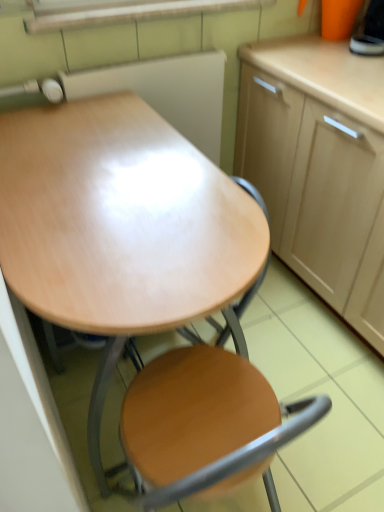
What do you see at coordinates (320, 167) in the screenshot? The image size is (384, 512). I see `light wood cabinet at upper right` at bounding box center [320, 167].

The width and height of the screenshot is (384, 512). I want to click on wooden at center, so click(x=205, y=424).

This screenshot has width=384, height=512. What do you see at coordinates (205, 424) in the screenshot?
I see `wooden at center` at bounding box center [205, 424].

The image size is (384, 512). Identify the location of light wood cabinet at upper right. (320, 167).

Does point (122, 314) appear closer or farther from the camera than point (377, 256)?

Point (122, 314) is positioned closer to the camera compared to point (377, 256).

Is wooden desk at center with light wood cabinet at upper right?

No, wooden desk at center is not with light wood cabinet at upper right.

Is wooden desk at center taller or shorter than light wood cabinet at upper right?

In the image, wooden desk at center appears to be shorter than light wood cabinet at upper right.

From a real-world perspective, which object rests below the other?

wooden desk at center, from a real-world perspective.

Can we say wooden desk at center lies outside wooden at center?

Indeed, wooden desk at center is completely outside wooden at center.

From a real-world perspective, who is located lower, wooden desk at center or wooden at center?

wooden at center.

Considering the sizes of wooden desk at center and wooden at center in the image, is wooden desk at center wider or thinner than wooden at center?

Clearly, wooden desk at center has more width compared to wooden at center.

Is wooden at center facing towards wooden desk at center?

Yes, wooden at center is facing wooden desk at center.

Which is less distant, (297, 417) or (19, 290)?

Point (297, 417).

From a real-world perspective, is wooden at center beneath wooden desk at center?

Yes, from a real-world perspective, wooden at center is below wooden desk at center.

Considering the relative sizes of wooden at center and wooden desk at center in the image provided, is wooden at center smaller than wooden desk at center?

Yes.

From a real-world perspective, is wooden at center located beneath light wood cabinet at upper right?

Yes, from a real-world perspective, wooden at center is beneath light wood cabinet at upper right.

Is point (224, 441) positioned behind point (245, 170)?

That is False.

Between wooden at center and light wood cabinet at upper right, which one has smaller width?

Thinner between the two is wooden at center.

Between light wood cabinet at upper right and wooden desk at center, which one has more height?

With more height is light wood cabinet at upper right.

Consider the image. Is the surface of light wood cabinet at upper right in direct contact with wooden desk at center?

No, light wood cabinet at upper right is not next to wooden desk at center.

Can you tell me how much light wood cabinet at upper right and wooden desk at center differ in facing direction?

The angle between the facing direction of light wood cabinet at upper right and the facing direction of wooden desk at center is 0.0791 degrees.

Which is more to the right, light wood cabinet at upper right or wooden desk at center?

From the viewer's perspective, light wood cabinet at upper right appears more on the right side.

What's the angular difference between light wood cabinet at upper right and wooden at center's facing directions?

There is a 91.1-degree angle between the facing directions of light wood cabinet at upper right and wooden at center.

Is light wood cabinet at upper right surrounding wooden at center?

Definitely not — wooden at center is not inside light wood cabinet at upper right.

In the scene shown: Is light wood cabinet at upper right bigger or smaller than wooden at center?

light wood cabinet at upper right is bigger than wooden at center.

Is light wood cabinet at upper right positioned far away from wooden at center?

No, there isn't a large distance between light wood cabinet at upper right and wooden at center.

This screenshot has height=512, width=384. I want to click on desk that appears below the light wood cabinet at upper right (from the image's perspective), so click(x=119, y=226).

At what (x,y) coordinates should I click in order to perform the action: click on chair on the right of wooden desk at center. Please return your answer as a coordinate pair (x, y). This screenshot has width=384, height=512. Looking at the image, I should click on (205, 424).

When comparing their distances from light wood cabinet at upper right, does wooden desk at center or wooden at center seem further?

wooden at center lies further to light wood cabinet at upper right than the other object.

When comparing their distances from wooden desk at center, does wooden at center or light wood cabinet at upper right seem further?

light wood cabinet at upper right.

From the image, which object appears to be farther from light wood cabinet at upper right, wooden at center or wooden desk at center?

The object further to light wood cabinet at upper right is wooden at center.

Looking at this image, from the image, which object appears to be nearer to wooden desk at center, light wood cabinet at upper right or wooden at center?

wooden at center is positioned closer to the anchor wooden desk at center.

Looking at the image, which one is located closer to wooden at center, light wood cabinet at upper right or wooden desk at center?

wooden desk at center is closer to wooden at center.

When comparing their distances from wooden at center, does wooden desk at center or light wood cabinet at upper right seem closer?

wooden desk at center is closer to wooden at center.

This screenshot has height=512, width=384. I want to click on chair between wooden desk at center and light wood cabinet at upper right, so click(205, 424).